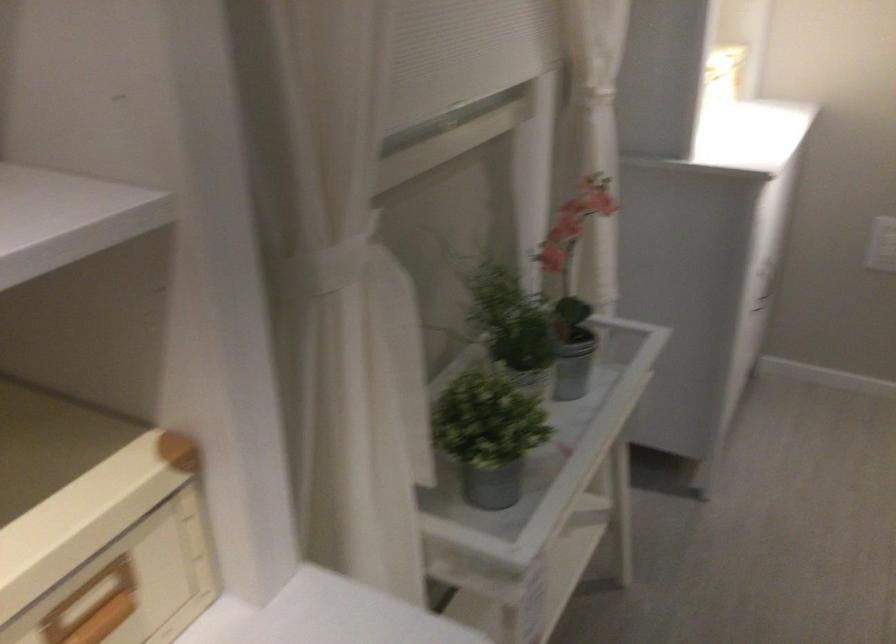
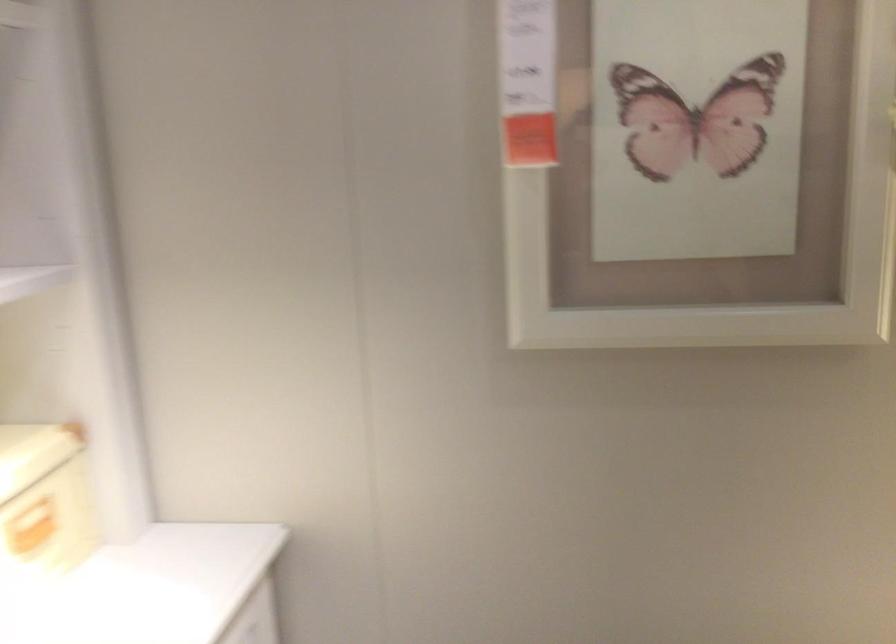
What movement of the cameraman would produce the second image?

The cameraman walked toward right, forward.